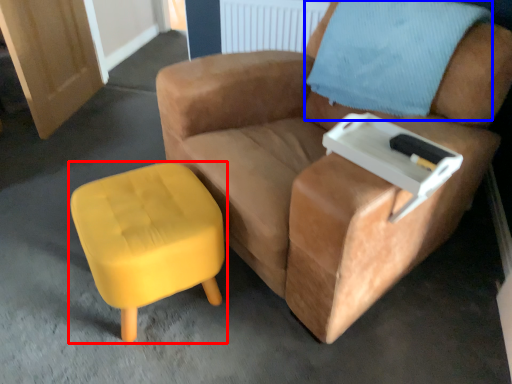
Question: Which object is closer to the camera taking this photo, stool (highlighted by a red box) or pillow (highlighted by a blue box)?

Choices:
 (A) stool
 (B) pillow

Answer: (A)